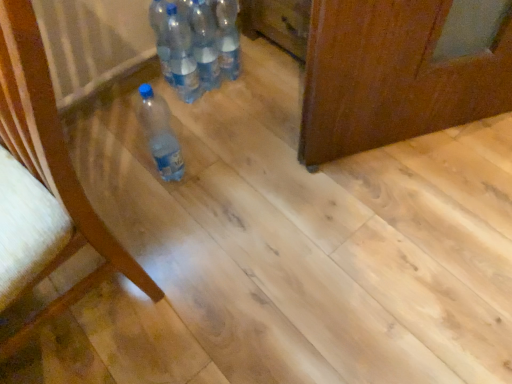
Question: Are translucent plastic bottles at center, which is the 2th bottle in top-to-bottom order, and translucent plastic bottle at center, marked as the 1th bottle in a top-to-bottom arrangement, making contact?

Choices:
 (A) yes
 (B) no

Answer: (A)

Question: Does translucent plastic bottles at center, which is the 2th bottle in top-to-bottom order, have a greater height compared to translucent plastic bottle at center, marked as the 1th bottle in a top-to-bottom arrangement?

Choices:
 (A) no
 (B) yes

Answer: (B)

Question: From the image's perspective, is translucent plastic bottles at center, which is the 2th bottle in top-to-bottom order, on translucent plastic bottle at center, marked as the 1th bottle in a top-to-bottom arrangement?

Choices:
 (A) yes
 (B) no

Answer: (B)

Question: Can you confirm if translucent plastic bottles at center, which is the 2th bottle in top-to-bottom order, is wider than translucent plastic bottle at center, marked as the 1th bottle in a top-to-bottom arrangement?

Choices:
 (A) no
 (B) yes

Answer: (A)

Question: Is translucent plastic bottles at center, the third bottle positioned from the bottom, facing away from translucent plastic bottle at center, the fourth bottle when ordered from bottom to top?

Choices:
 (A) no
 (B) yes

Answer: (A)

Question: Can you confirm if translucent plastic bottles at center, which is the 2th bottle in top-to-bottom order, is positioned to the right of translucent plastic bottle at center, marked as the 1th bottle in a top-to-bottom arrangement?

Choices:
 (A) no
 (B) yes

Answer: (A)

Question: Is translucent plastic bottles at center, the third bottle positioned from the bottom, taller than clear plastic bottle at center, which is counted as the second bottle, starting from the bottom?

Choices:
 (A) no
 (B) yes

Answer: (B)

Question: Is translucent plastic bottles at center, which is the 2th bottle in top-to-bottom order, smaller than clear plastic bottle at center, the 3th bottle viewed from the top?

Choices:
 (A) no
 (B) yes

Answer: (B)

Question: Considering the relative positions of translucent plastic bottles at center, which is the 2th bottle in top-to-bottom order, and clear plastic bottle at center, which is counted as the second bottle, starting from the bottom, in the image provided, is translucent plastic bottles at center, which is the 2th bottle in top-to-bottom order, to the left of clear plastic bottle at center, which is counted as the second bottle, starting from the bottom, from the viewer's perspective?

Choices:
 (A) yes
 (B) no

Answer: (B)

Question: From the image's perspective, is translucent plastic bottles at center, which is the 2th bottle in top-to-bottom order, below clear plastic bottle at center, which is counted as the second bottle, starting from the bottom?

Choices:
 (A) yes
 (B) no

Answer: (B)

Question: Is translucent plastic bottles at center, which is the 2th bottle in top-to-bottom order, to the right of clear plastic bottle at center, the 3th bottle viewed from the top, from the viewer's perspective?

Choices:
 (A) no
 (B) yes

Answer: (B)

Question: Is translucent plastic bottles at center, which is the 2th bottle in top-to-bottom order, surrounding clear plastic bottle at center, which is counted as the second bottle, starting from the bottom?

Choices:
 (A) no
 (B) yes

Answer: (A)

Question: Is matte wood chair at left closer to the viewer compared to clear plastic bottle at center, the 3th bottle viewed from the top?

Choices:
 (A) no
 (B) yes

Answer: (B)